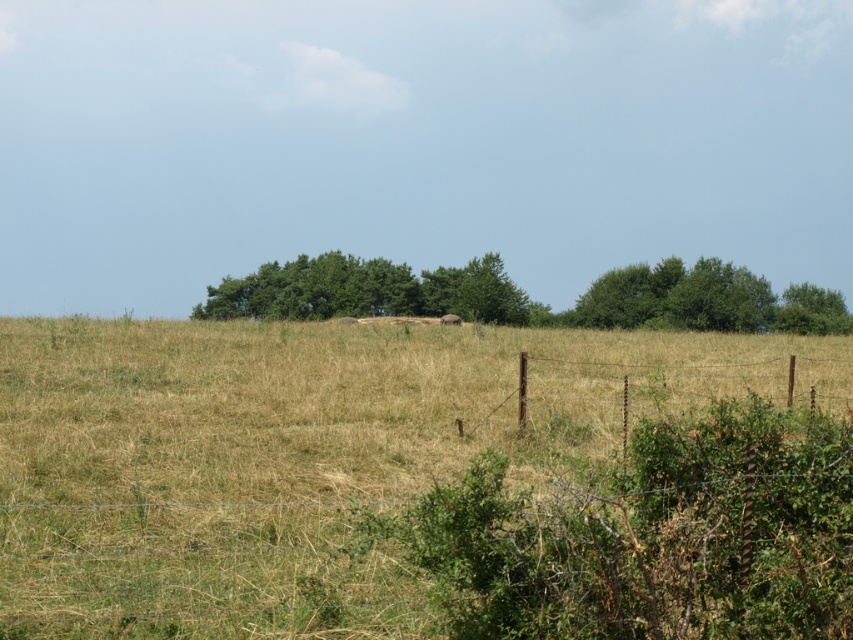
Who is higher up, dry grass at center or green leafy trees at center?

green leafy trees at center is above.

Does dry grass at center come behind green leafy trees at center?

No.

Locate an element on the screen. The image size is (853, 640). dry grass at center is located at coordinates (309, 456).

In the scene shown: Does brown wire fence at center have a greater height compared to green leafy trees at center?

Incorrect, brown wire fence at center's height is not larger of green leafy trees at center's.

I want to click on brown wire fence at center, so click(x=529, y=392).

Between green leafy tree at center and green leafy tree at upper right, which one has less height?

green leafy tree at upper right

Who is higher up, green leafy tree at center or green leafy tree at upper right?

green leafy tree at upper right

Is point (256, 308) less distant than point (817, 310)?

Yes, it is in front of point (817, 310).

This screenshot has height=640, width=853. I want to click on green leafy tree at center, so click(367, 291).